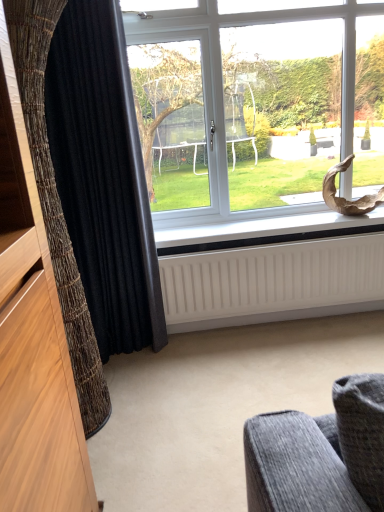
Question: Is white matte radiator at lower center wider than black textured curtain at left, positioned as the 2th curtain in back-to-front order?

Choices:
 (A) no
 (B) yes

Answer: (A)

Question: From the image's perspective, is white matte radiator at lower center beneath black textured curtain at left, positioned as the 2th curtain in back-to-front order?

Choices:
 (A) yes
 (B) no

Answer: (B)

Question: Does white matte radiator at lower center appear on the right side of black textured curtain at left, which is counted as the first curtain, starting from the front?

Choices:
 (A) no
 (B) yes

Answer: (B)

Question: Does white matte radiator at lower center have a larger size compared to black textured curtain at left, positioned as the 2th curtain in back-to-front order?

Choices:
 (A) no
 (B) yes

Answer: (A)

Question: Is white matte radiator at lower center surrounding black textured curtain at left, which is counted as the first curtain, starting from the front?

Choices:
 (A) yes
 (B) no

Answer: (B)

Question: From their relative heights in the image, would you say transparent glass window at center is taller or shorter than black textured curtain at left, which appears as the second curtain when viewed from the front?

Choices:
 (A) short
 (B) tall

Answer: (A)

Question: Is point (337, 96) closer or farther from the camera than point (77, 211)?

Choices:
 (A) closer
 (B) farther

Answer: (B)

Question: Choose the correct answer: Is transparent glass window at center inside black textured curtain at left, the first curtain positioned from the back, or outside it?

Choices:
 (A) inside
 (B) outside

Answer: (B)

Question: Relative to black textured curtain at left, which appears as the second curtain when viewed from the front, is transparent glass window at center in front or behind?

Choices:
 (A) behind
 (B) front

Answer: (A)

Question: Would you say black textured curtain at left, which is counted as the first curtain, starting from the front, is to the left or to the right of white ribbed radiator at lower center in the picture?

Choices:
 (A) right
 (B) left

Answer: (B)

Question: From the image's perspective, relative to white ribbed radiator at lower center, is black textured curtain at left, which is counted as the first curtain, starting from the front, above or below?

Choices:
 (A) above
 (B) below

Answer: (A)

Question: Looking at their shapes, would you say black textured curtain at left, positioned as the 2th curtain in back-to-front order, is wider or thinner than white ribbed radiator at lower center?

Choices:
 (A) thin
 (B) wide

Answer: (B)

Question: Is black textured curtain at left, positioned as the 2th curtain in back-to-front order, in front of or behind white ribbed radiator at lower center in the image?

Choices:
 (A) front
 (B) behind

Answer: (A)

Question: Is black textured curtain at left, positioned as the 2th curtain in back-to-front order, spatially inside black textured curtain at left, the first curtain positioned from the back, or outside of it?

Choices:
 (A) outside
 (B) inside

Answer: (A)

Question: Is black textured curtain at left, which is counted as the first curtain, starting from the front, taller or shorter than black textured curtain at left, the first curtain positioned from the back?

Choices:
 (A) short
 (B) tall

Answer: (A)